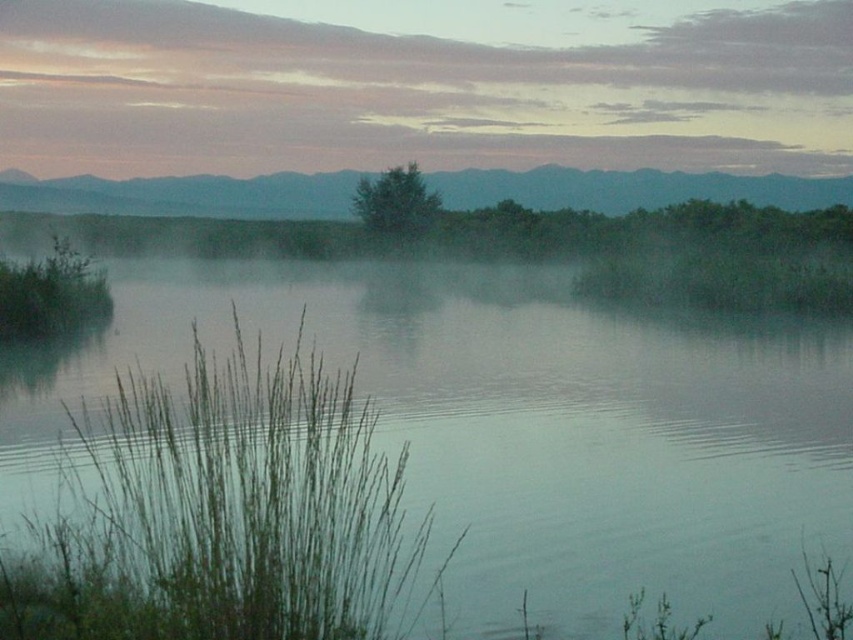
Can you confirm if green grassy river at center is taller than green matte tree at center?

No.

Who is shorter, green grassy river at center or green matte tree at center?

green grassy river at center is shorter.

Image resolution: width=853 pixels, height=640 pixels. In order to click on green grassy river at center in this screenshot , I will do `click(521, 426)`.

Who is positioned more to the right, green grassy river at center or pastel sky clouds at upper center?

green grassy river at center

Can you confirm if green grassy river at center is positioned above pastel sky clouds at upper center?

Incorrect, green grassy river at center is not positioned above pastel sky clouds at upper center.

Find the location of a particular element. This screenshot has width=853, height=640. green grassy river at center is located at coordinates (521, 426).

Image resolution: width=853 pixels, height=640 pixels. I want to click on green grassy river at center, so click(x=521, y=426).

Does point (289, 45) come behind point (102, 573)?

Yes, it is behind point (102, 573).

Does pastel sky clouds at upper center appear under green grass at left?

Actually, pastel sky clouds at upper center is above green grass at left.

Which is behind, point (132, 74) or point (86, 477)?

The point (132, 74) is more distant.

The image size is (853, 640). In order to click on pastel sky clouds at upper center in this screenshot , I will do `click(416, 92)`.